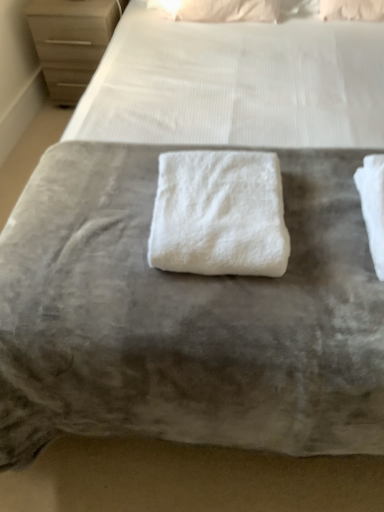
Question: From the image's perspective, is white fluffy towel at center located above or below matte wood chest of drawers at upper left?

Choices:
 (A) above
 (B) below

Answer: (B)

Question: In the image, is white fluffy towel at center positioned in front of or behind matte wood chest of drawers at upper left?

Choices:
 (A) behind
 (B) front

Answer: (B)

Question: Based on their relative distances, which object is farther from the white soft pillow at upper center?

Choices:
 (A) white fluffy towel at center
 (B) matte wood chest of drawers at upper left

Answer: (A)

Question: Estimate the real-world distances between objects in this image. Which object is closer to the white fluffy towel at center?

Choices:
 (A) white soft pillow at upper center
 (B) matte wood chest of drawers at upper left

Answer: (A)